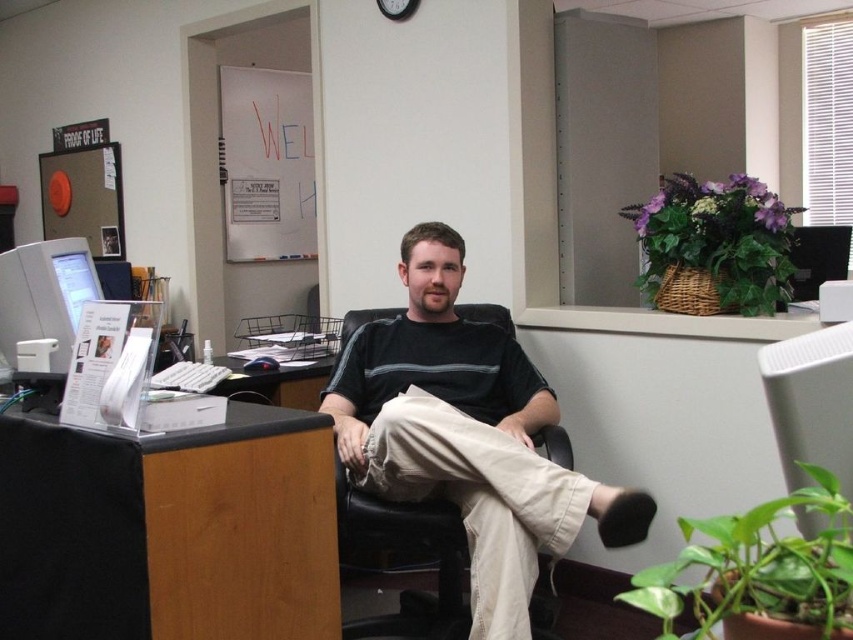
You are standing in front of the black matte computer desk at lower left and want to reach the keyboard on it. Considering your arm can extend 0.8 meters, can you reach the keyboard without moving?

The distance between you and the black matte computer desk at lower left is 1.67 meters, which is greater than your arm extension of 0.8 meters. Therefore, you cannot reach the keyboard without moving closer.

You are an office worker who needs to place a new 15cm wide document organizer on your desk. Given the black matte computer desk at lower left and the dark gray striped shirt at center, can the desk accommodate the organizer without moving the shirt?

The black matte computer desk at lower left has a width larger than the dark gray striped shirt at center. Since the desk is wider than the shirt, there should be enough space to place the 15cm organizer without moving the shirt.

You are standing in front of the office desk and want to reach a point that is 1.97 meters away from you. Can you confirm if the point at coordinates (331, 589) is exactly at that distance?

The point at coordinates (331, 589) is exactly 1.97 meters away from the viewer, so yes, it is at that distance.